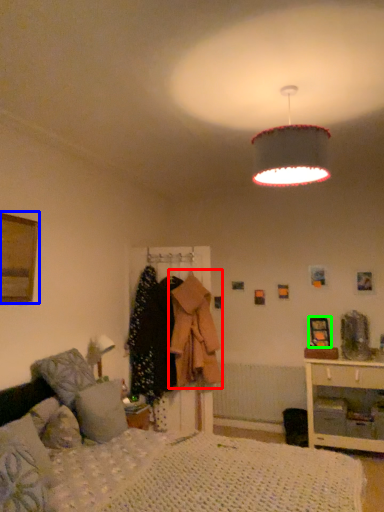
Question: Considering the real-world distances, which object is closest to clothing (highlighted by a red box)? picture frame (highlighted by a blue box) or picture frame (highlighted by a green box).

Choices:
 (A) picture frame
 (B) picture frame

Answer: (B)